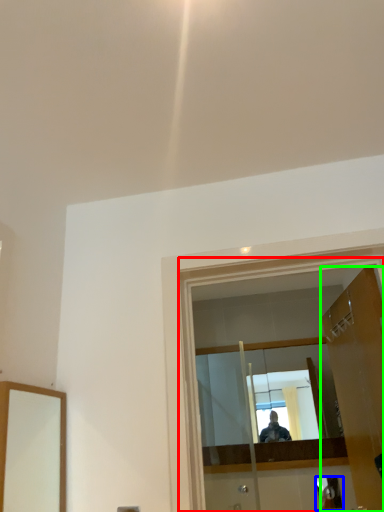
Question: Which is farther away from glass door (highlighted by a red box)? reflection (highlighted by a blue box) or door (highlighted by a green box)?

Choices:
 (A) reflection
 (B) door

Answer: (A)